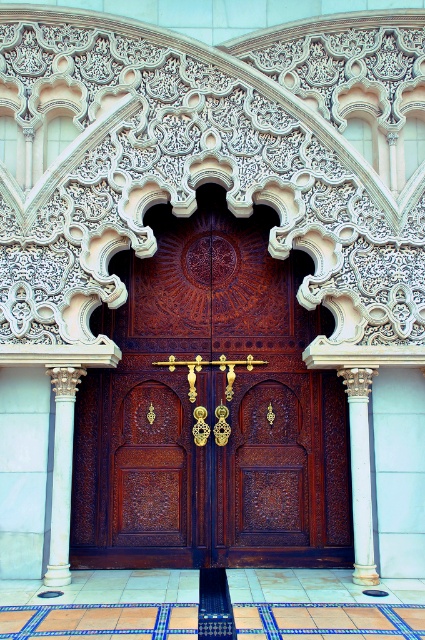
You are an architect planning to install a new decorative element between the white marble column at left and the white marble column at center. The element requires a minimum of 8 meters of space. Can the space between them accommodate this requirement?

The white marble column at left is 8.27 meters away from the white marble column at center, which exceeds the minimum requirement of 8 meters. Therefore, the space between them can accommodate the new decorative element.